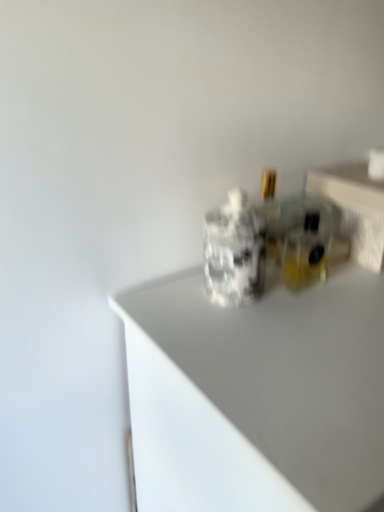
Question: Is transparent glass perfume bottles at upper right smaller than white glossy countertop at center?

Choices:
 (A) yes
 (B) no

Answer: (A)

Question: Is transparent glass perfume bottles at upper right positioned with its back to white glossy countertop at center?

Choices:
 (A) no
 (B) yes

Answer: (A)

Question: From a real-world perspective, is transparent glass perfume bottles at upper right located beneath white glossy countertop at center?

Choices:
 (A) yes
 (B) no

Answer: (B)

Question: Would you consider transparent glass perfume bottles at upper right to be distant from white glossy countertop at center?

Choices:
 (A) yes
 (B) no

Answer: (B)

Question: Is transparent glass perfume bottles at upper right not within white glossy countertop at center?

Choices:
 (A) yes
 (B) no

Answer: (A)

Question: Is transparent glass perfume bottles at upper right facing towards white glossy countertop at center?

Choices:
 (A) no
 (B) yes

Answer: (A)

Question: Would you say white glossy countertop at center contains transparent glass perfume bottles at upper right?

Choices:
 (A) yes
 (B) no

Answer: (B)

Question: Is white glossy countertop at center wider than transparent glass perfume bottles at upper right?

Choices:
 (A) no
 (B) yes

Answer: (B)

Question: Is white glossy countertop at center at the left side of transparent glass perfume bottles at upper right?

Choices:
 (A) no
 (B) yes

Answer: (B)

Question: Can you confirm if white glossy countertop at center is positioned to the right of transparent glass perfume bottles at upper right?

Choices:
 (A) no
 (B) yes

Answer: (A)

Question: Is white glossy countertop at center not inside transparent glass perfume bottles at upper right?

Choices:
 (A) yes
 (B) no

Answer: (A)

Question: Is white glossy countertop at center facing towards transparent glass perfume bottles at upper right?

Choices:
 (A) no
 (B) yes

Answer: (A)

Question: Is white glossy countertop at center situated inside transparent glass perfume bottles at upper right or outside?

Choices:
 (A) outside
 (B) inside

Answer: (A)